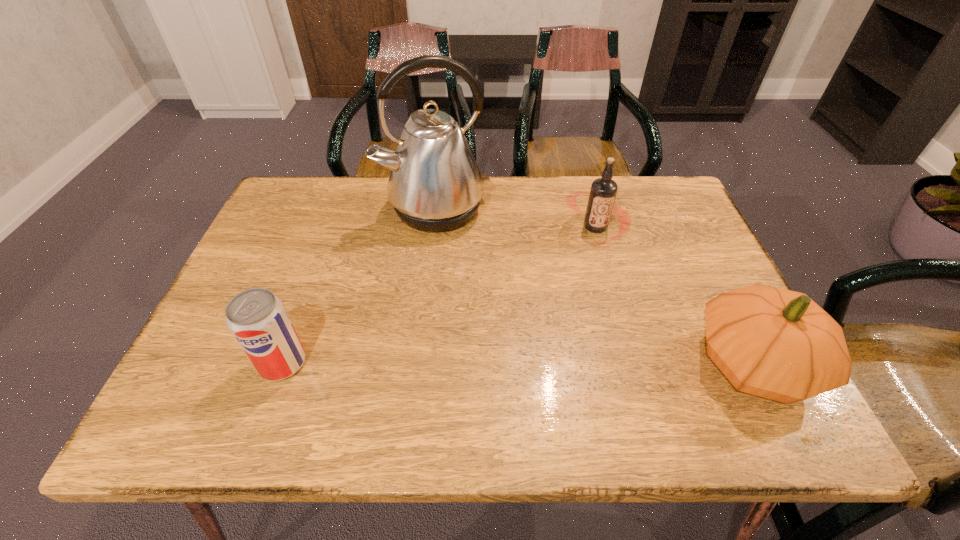
This screenshot has width=960, height=540. Find the location of `free point that satisfies the following two spatial constraints: 1. on the back side of the root beer; 2. on the left side of the leftmost object`. free point that satisfies the following two spatial constraints: 1. on the back side of the root beer; 2. on the left side of the leftmost object is located at coordinates (332, 227).

The image size is (960, 540). Find the location of `free location that satisfies the following two spatial constraints: 1. on the front side of the kettle; 2. on the right side of the second object from right to left`. free location that satisfies the following two spatial constraints: 1. on the front side of the kettle; 2. on the right side of the second object from right to left is located at coordinates (434, 227).

This screenshot has height=540, width=960. I want to click on vacant space that satisfies the following two spatial constraints: 1. on the back side of the soda; 2. on the left side of the third object from right to left, so click(339, 208).

Where is `free spot that satisfies the following two spatial constraints: 1. on the front side of the soda; 2. on the side of the rightmost object with the carved face`? The height and width of the screenshot is (540, 960). free spot that satisfies the following two spatial constraints: 1. on the front side of the soda; 2. on the side of the rightmost object with the carved face is located at coordinates (282, 363).